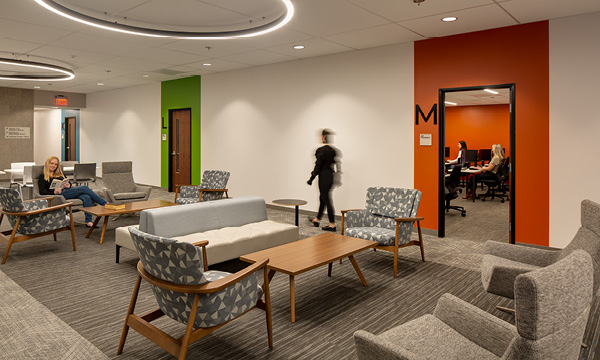
The image size is (600, 360). Identify the location of 2 wood coffee tables. (313, 248), (125, 205).